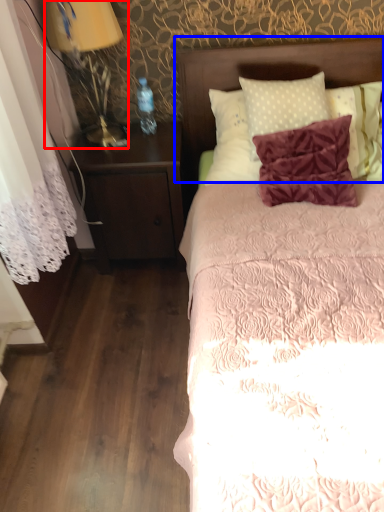
Question: Which of the following is the closest to the observer, bedside lamp (highlighted by a red box) or headboard (highlighted by a blue box)?

Choices:
 (A) bedside lamp
 (B) headboard

Answer: (A)